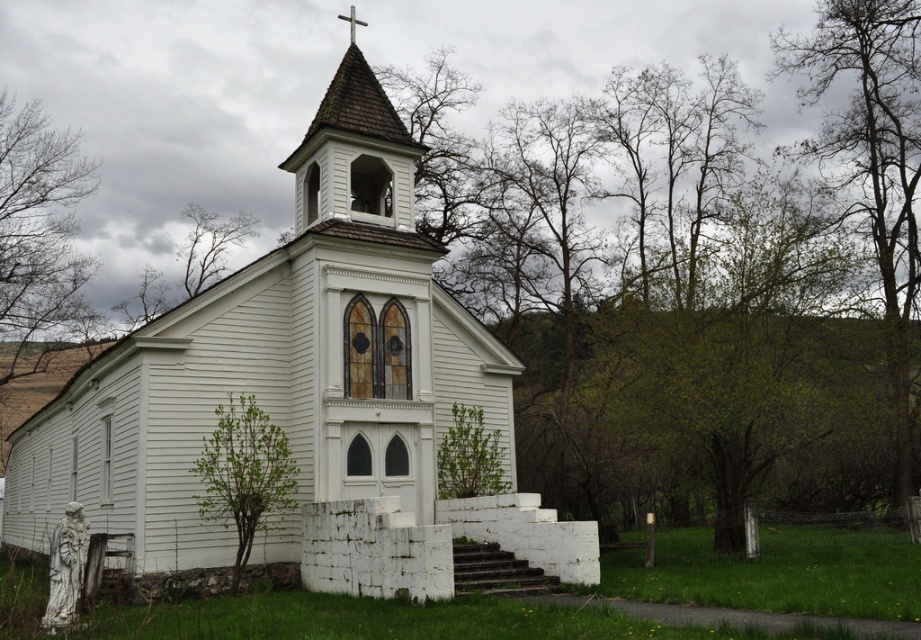
Question: Is white wood church at center thinner than bare branches at left?

Choices:
 (A) yes
 (B) no

Answer: (B)

Question: Which point is closer to the camera?

Choices:
 (A) (205, 248)
 (B) (43, 324)
 (C) (246, 518)

Answer: (C)

Question: Which point appears farthest from the camera in this image?

Choices:
 (A) (417, 332)
 (B) (214, 484)
 (C) (42, 156)

Answer: (C)

Question: Can you confirm if white wood church at center is wider than bare branches at left?

Choices:
 (A) no
 (B) yes

Answer: (B)

Question: In this image, where is wooden shingles at upper center located relative to bare branches at upper left?

Choices:
 (A) left
 (B) right

Answer: (B)

Question: Which of the following is the farthest from the observer?

Choices:
 (A) (239, 566)
 (B) (522, 276)
 (C) (915, 307)

Answer: (B)